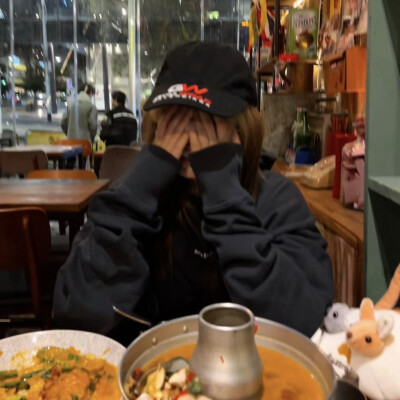
You are a GUI agent. You are given a task and a screenshot of the screen. Output one action in this format:
    pyautogui.click(x=<x>, y=<y>)
    Task: Click on the green shelf
    The width and height of the screenshot is (400, 400).
    Given the screenshot: What is the action you would take?
    pyautogui.click(x=384, y=103)